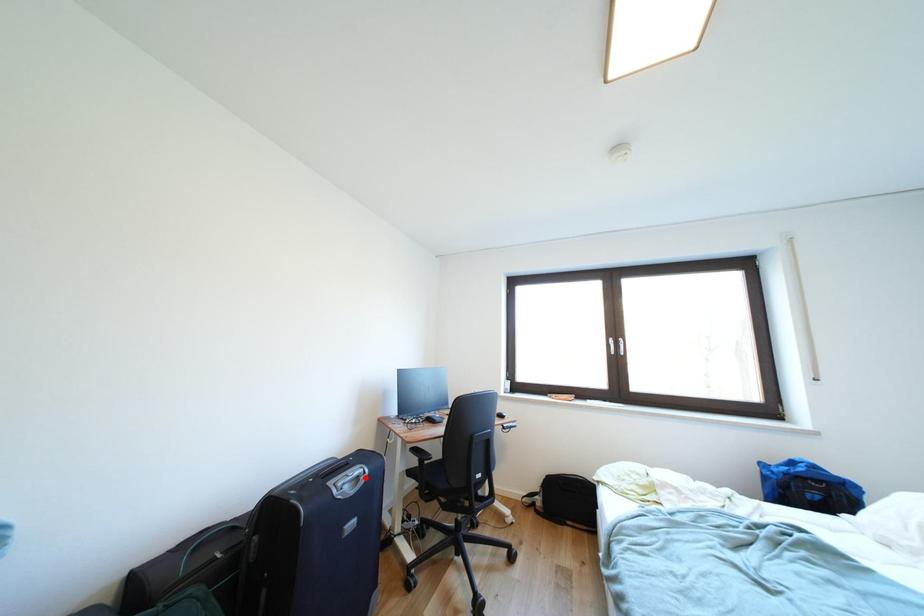
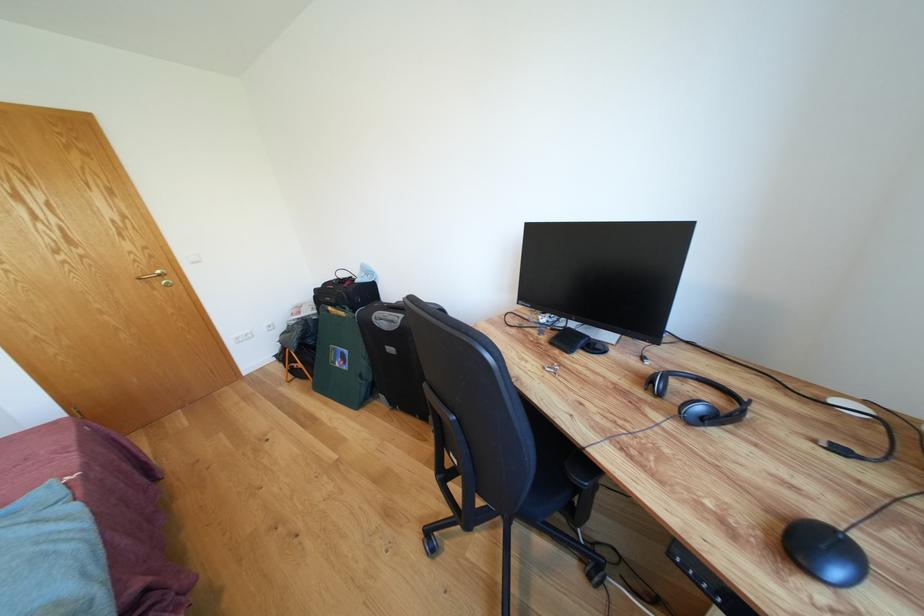
The point at the highlighted location is marked in the first image. Where is the corresponding point in the second image?

(398, 322)